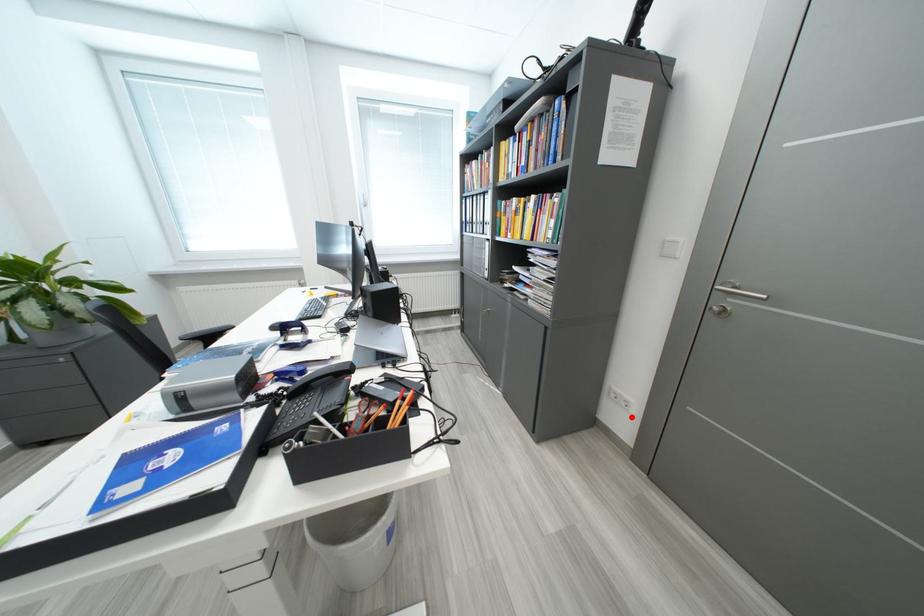
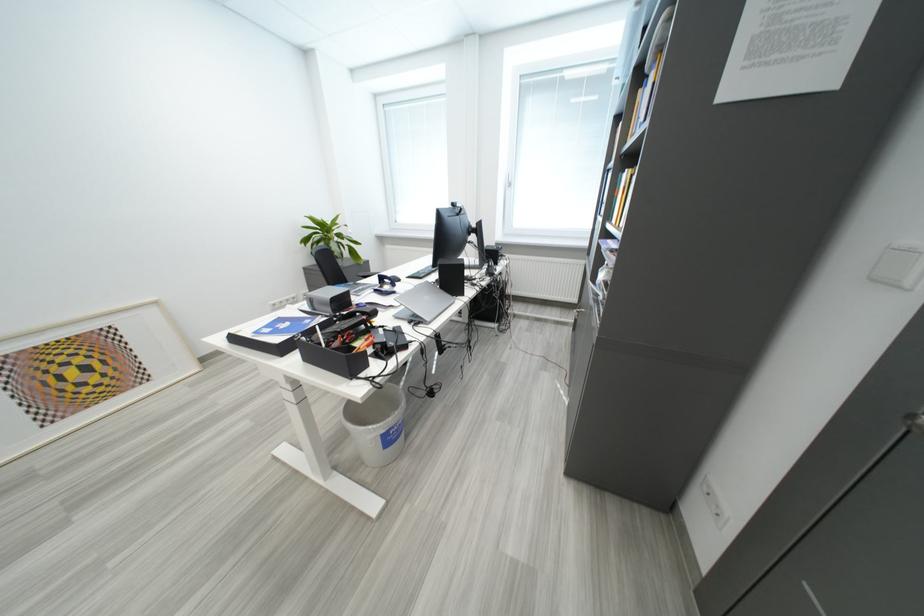
Question: I am providing you with two images of the same scene from different viewpoints. A red point is shown in image1. For the corresponding object point in image2, is it positioned nearer or farther from the camera?

Choices:
 (A) Nearer
 (B) Farther

Answer: (A)